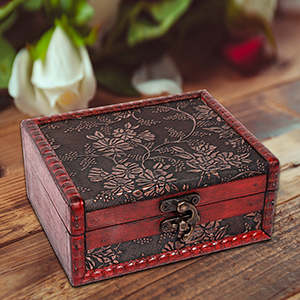
The image size is (300, 300). Identify the location of wood table. (237, 281).